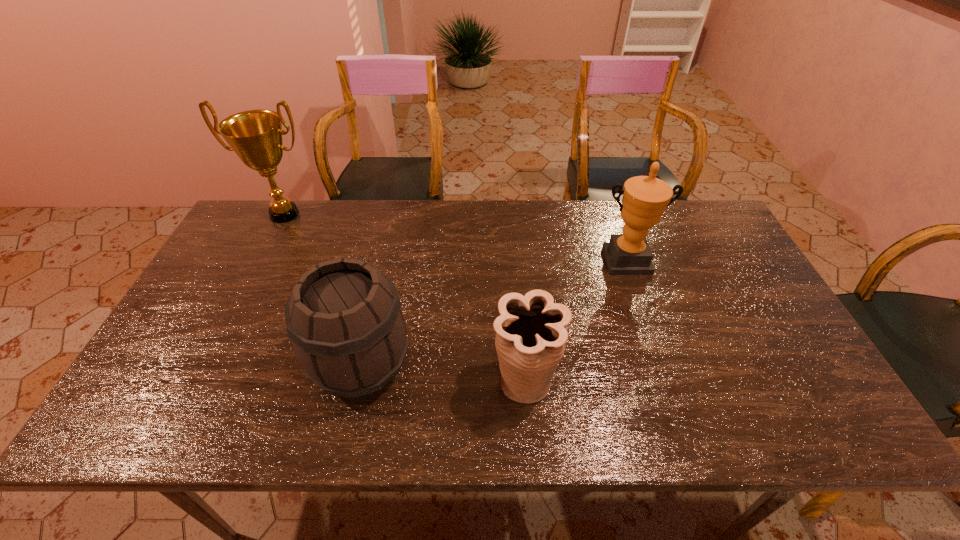
Where is `object that is the third nearest to the shorter award`? This screenshot has width=960, height=540. object that is the third nearest to the shorter award is located at coordinates (255, 136).

You are a GUI agent. You are given a task and a screenshot of the screen. Output one action in this format:
    pyautogui.click(x=<x>, y=<y>)
    Task: Click on the object that is the third nearest to the third tallest object
    This screenshot has height=540, width=960.
    Given the screenshot: What is the action you would take?
    pyautogui.click(x=645, y=198)

This screenshot has height=540, width=960. I want to click on free location that satisfies the following two spatial constraints: 1. on the front view with handles of the third object from right to left; 2. on the right side of the farther award, so click(206, 366).